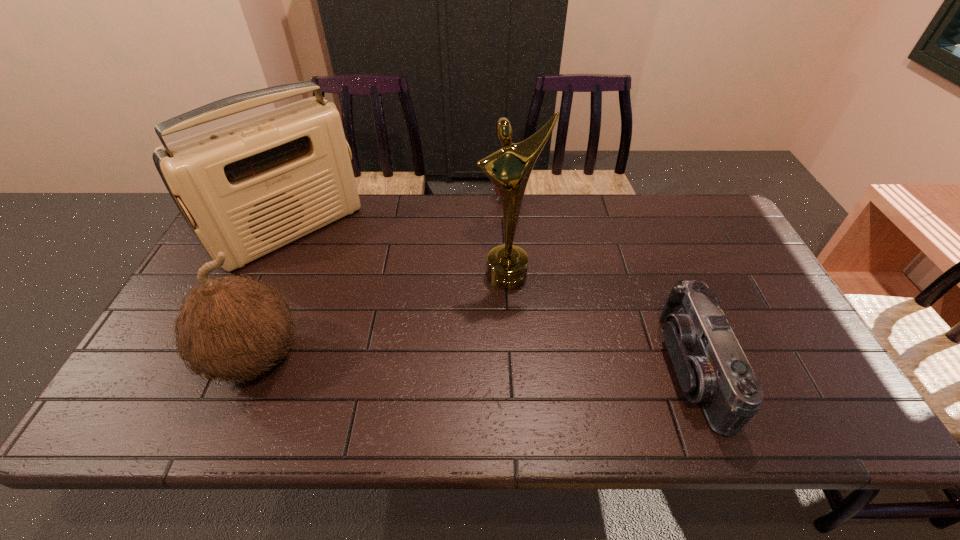
What are the coordinates of `free space on the desktop that is between the third shortest object and the rightmost object and is positioned on the front-facing side of the award` in the screenshot? It's located at (531, 365).

You are a GUI agent. You are given a task and a screenshot of the screen. Output one action in this format:
    pyautogui.click(x=<x>, y=<y>)
    Task: Click on the vacant space on the desktop that is between the third tallest object and the camcorder and is positioned on the clock face of the alarm clock
    This screenshot has width=960, height=540.
    Given the screenshot: What is the action you would take?
    pyautogui.click(x=433, y=362)

Image resolution: width=960 pixels, height=540 pixels. What are the coordinates of `vacant space on the desktop that is between the third tallest object and the rightmost object and is positioned on the front-facing side of the radio receiver` in the screenshot? It's located at point(423,362).